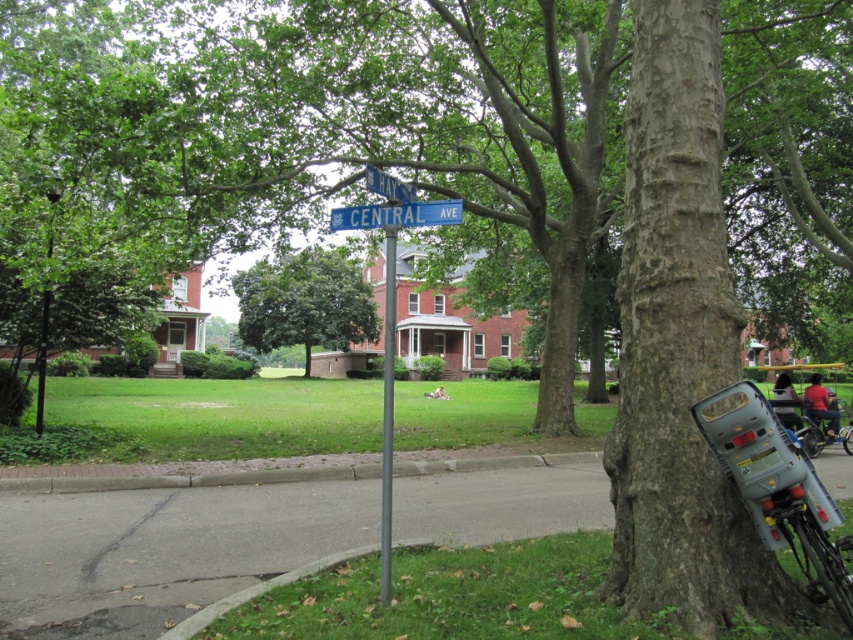
Question: Can you confirm if blue metallic street sign at center is positioned to the right of blue plastic street sign at upper center?

Choices:
 (A) yes
 (B) no

Answer: (A)

Question: Does green leafy tree at center lie in front of blue metallic street sign at center?

Choices:
 (A) yes
 (B) no

Answer: (B)

Question: Which object is farther from the camera taking this photo?

Choices:
 (A) metallic pole at center
 (B) metallic gray bicycle at tree right
 (C) green leafy tree at center

Answer: (C)

Question: Is blue metallic street sign at center in front of black metal pole at upper left?

Choices:
 (A) yes
 (B) no

Answer: (A)

Question: Among these objects, which one is farthest from the camera?

Choices:
 (A) black metal pole at upper left
 (B) metallic gray bicycle at tree right
 (C) metallic silver bicycle at lower right
 (D) blue plastic street sign at upper center

Answer: (C)

Question: Which of the following is the farthest from the observer?

Choices:
 (A) metallic gray bicycle at tree right
 (B) blue plastic street sign at upper center
 (C) green leafy tree at center

Answer: (C)